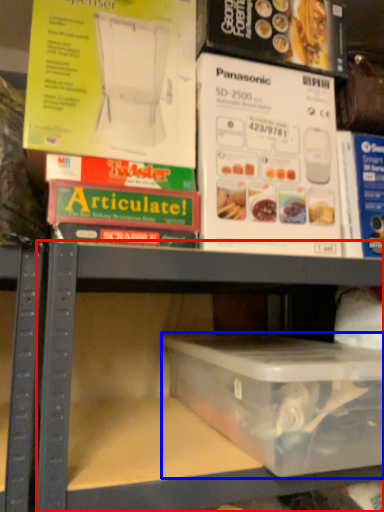
Question: Which point is closer to the camera, shelf (highlighted by a red box) or box (highlighted by a blue box)?

Choices:
 (A) shelf
 (B) box

Answer: (A)